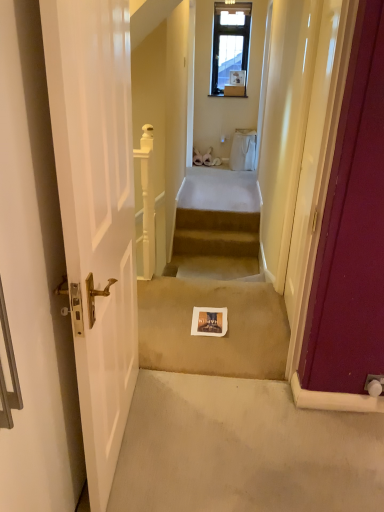
Image resolution: width=384 pixels, height=512 pixels. What do you see at coordinates (352, 230) in the screenshot?
I see `matte burgundy door at right, placed as the second door when sorted from left to right` at bounding box center [352, 230].

Image resolution: width=384 pixels, height=512 pixels. What do you see at coordinates (34, 281) in the screenshot? I see `white glossy door at left, the 1th door when ordered from left to right` at bounding box center [34, 281].

The height and width of the screenshot is (512, 384). What are the coordinates of `white glossy door at left, the 1th door when ordered from left to right` in the screenshot? It's located at (34, 281).

Find the location of a particular element. This screenshot has height=512, width=384. matte burgundy door at right, which is the first door in right-to-left order is located at coordinates (352, 230).

Where is `door above the white glossy door at left, the 1th door when ordered from left to right (from the image's perspective)`? The height and width of the screenshot is (512, 384). door above the white glossy door at left, the 1th door when ordered from left to right (from the image's perspective) is located at coordinates (352, 230).

Who is smaller, matte burgundy door at right, placed as the second door when sorted from left to right, or white glossy door at left, the second door when ordered from right to left?

Smaller between the two is matte burgundy door at right, placed as the second door when sorted from left to right.

In the image, is matte burgundy door at right, placed as the second door when sorted from left to right, positioned in front of or behind white glossy door at left, the second door when ordered from right to left?

In the image, matte burgundy door at right, placed as the second door when sorted from left to right, appears behind white glossy door at left, the second door when ordered from right to left.

From the image's perspective, between matte burgundy door at right, placed as the second door when sorted from left to right, and white glossy door at left, the second door when ordered from right to left, which one is located above?

From the image's view, matte burgundy door at right, placed as the second door when sorted from left to right, is above.

Is white glossy door at left, the 1th door when ordered from left to right, looking in the opposite direction of white paper at center?

No, white glossy door at left, the 1th door when ordered from left to right,'s orientation is not away from white paper at center.

Can you confirm if white glossy door at left, the 1th door when ordered from left to right, is thinner than white paper at center?

Yes.

Which is more to the right, white glossy door at left, the second door when ordered from right to left, or white paper at center?

Positioned to the right is white paper at center.

From the image's perspective, between white glossy door at left, the 1th door when ordered from left to right, and white paper at center, which one is located above?

white glossy door at left, the 1th door when ordered from left to right, is shown above in the image.

Based on the photo, can you confirm if white paper at center is bigger than matte burgundy door at right, placed as the second door when sorted from left to right?

No, white paper at center is not bigger than matte burgundy door at right, placed as the second door when sorted from left to right.

Measure the distance between white paper at center and matte burgundy door at right, which is the first door in right-to-left order.

white paper at center is 30.93 inches away from matte burgundy door at right, which is the first door in right-to-left order.

Considering the relative sizes of white paper at center and matte burgundy door at right, placed as the second door when sorted from left to right, in the image provided, is white paper at center thinner than matte burgundy door at right, placed as the second door when sorted from left to right,?

In fact, white paper at center might be wider than matte burgundy door at right, placed as the second door when sorted from left to right.

Is white paper at center behind matte burgundy door at right, which is the first door in right-to-left order?

Yes, it is.

This screenshot has height=512, width=384. In order to click on door above the white glossy door at left, the 1th door when ordered from left to right (from the image's perspective) in this screenshot , I will do `click(352, 230)`.

Can you confirm if white glossy door at left, the second door when ordered from right to left, is thinner than matte burgundy door at right, which is the first door in right-to-left order?

No, white glossy door at left, the second door when ordered from right to left, is not thinner than matte burgundy door at right, which is the first door in right-to-left order.

From the image's perspective, which is below, white glossy door at left, the 1th door when ordered from left to right, or matte burgundy door at right, which is the first door in right-to-left order?

white glossy door at left, the 1th door when ordered from left to right.

Measure the distance between white glossy door at left, the 1th door when ordered from left to right, and matte burgundy door at right, which is the first door in right-to-left order.

A distance of 3.49 feet exists between white glossy door at left, the 1th door when ordered from left to right, and matte burgundy door at right, which is the first door in right-to-left order.

Does point (207, 229) come in front of point (229, 371)?

No, it is not.

Visually, is beige carpeted stairs at center positioned to the left or to the right of white paper at center?

beige carpeted stairs at center is to the right of white paper at center.

How distant is beige carpeted stairs at center from white paper at center?

beige carpeted stairs at center is 1.60 meters from white paper at center.

Identify the location of stairs on the right side of white paper at center. The image size is (384, 512). (216, 233).

From the image's perspective, is white paper at center over white glossy door at left, the second door when ordered from right to left?

Incorrect, from the image's perspective, white paper at center is lower than white glossy door at left, the second door when ordered from right to left.

Which is behind, point (280, 344) or point (8, 498)?

The point (280, 344) is behind.

Considering the relative sizes of white paper at center and white glossy door at left, the 1th door when ordered from left to right, in the image provided, is white paper at center wider than white glossy door at left, the 1th door when ordered from left to right,?

Indeed, white paper at center has a greater width compared to white glossy door at left, the 1th door when ordered from left to right.

Which object is positioned more to the right, white paper at center or white glossy door at left, the 1th door when ordered from left to right?

white paper at center is more to the right.

What are the coordinates of `stairs above the white paper at center (from the image's perspective)` in the screenshot? It's located at (216, 233).

Is white paper at center not near beige carpeted stairs at center?

Absolutely, white paper at center is distant from beige carpeted stairs at center.

From a real-world perspective, is white paper at center physically below beige carpeted stairs at center?

Incorrect, from a real-world perspective, white paper at center is higher than beige carpeted stairs at center.

Does white paper at center have a smaller size compared to beige carpeted stairs at center?

No.

Where is `door that appears on the right of white glossy door at left, the 1th door when ordered from left to right`? door that appears on the right of white glossy door at left, the 1th door when ordered from left to right is located at coordinates (352, 230).

Locate an element on the screen. door that is the 1st one when counting upward from the white paper at center (from the image's perspective) is located at coordinates (34, 281).

Considering their positions, is white glossy door at left, the 1th door when ordered from left to right, positioned further to white paper at center than beige carpeted stairs at center?

beige carpeted stairs at center is further to white paper at center.

When comparing their distances from matte burgundy door at right, which is the first door in right-to-left order, does white glossy door at left, the second door when ordered from right to left, or beige carpeted stairs at center seem closer?

Based on the image, white glossy door at left, the second door when ordered from right to left, appears to be nearer to matte burgundy door at right, which is the first door in right-to-left order.

From the image, which object appears to be farther from white paper at center, white glossy door at left, the second door when ordered from right to left, or matte burgundy door at right, placed as the second door when sorted from left to right?

Among the two, white glossy door at left, the second door when ordered from right to left, is located further to white paper at center.

Considering their positions, is white paper at center positioned closer to beige carpeted stairs at center than white glossy door at left, the 1th door when ordered from left to right?

white paper at center lies closer to beige carpeted stairs at center than the other object.

Looking at the image, which one is located further to matte burgundy door at right, placed as the second door when sorted from left to right, beige carpeted stairs at center or white paper at center?

Among the two, beige carpeted stairs at center is located further to matte burgundy door at right, placed as the second door when sorted from left to right.

Based on their spatial positions, is beige carpeted stairs at center or white glossy door at left, the second door when ordered from right to left, further from white paper at center?

The object further to white paper at center is beige carpeted stairs at center.

Looking at the image, which one is located further to matte burgundy door at right, which is the first door in right-to-left order, white paper at center or beige carpeted stairs at center?

Based on the image, beige carpeted stairs at center appears to be further to matte burgundy door at right, which is the first door in right-to-left order.

In the scene shown: Estimate the real-world distances between objects in this image. Which object is closer to white paper at center, matte burgundy door at right, which is the first door in right-to-left order, or white glossy door at left, the second door when ordered from right to left?

The object closer to white paper at center is matte burgundy door at right, which is the first door in right-to-left order.

You are a GUI agent. You are given a task and a screenshot of the screen. Output one action in this format:
    pyautogui.click(x=<x>, y=<y>)
    Task: Click on the concrete between matte burgundy door at right, which is the first door in right-to-left order, and beige carpeted stairs at center from front to back
    This screenshot has width=384, height=512.
    Given the screenshot: What is the action you would take?
    pyautogui.click(x=213, y=337)

You are a GUI agent. You are given a task and a screenshot of the screen. Output one action in this format:
    pyautogui.click(x=<x>, y=<y>)
    Task: Click on the concrete positioned between white glossy door at left, the second door when ordered from right to left, and beige carpeted stairs at center from near to far
    This screenshot has width=384, height=512.
    Given the screenshot: What is the action you would take?
    pyautogui.click(x=213, y=337)

Where is `door positioned between white glossy door at left, the 1th door when ordered from left to right, and beige carpeted stairs at center from near to far`? The image size is (384, 512). door positioned between white glossy door at left, the 1th door when ordered from left to right, and beige carpeted stairs at center from near to far is located at coordinates (352, 230).

Where is `door between white glossy door at left, the 1th door when ordered from left to right, and white paper at center, along the z-axis`? door between white glossy door at left, the 1th door when ordered from left to right, and white paper at center, along the z-axis is located at coordinates (352, 230).